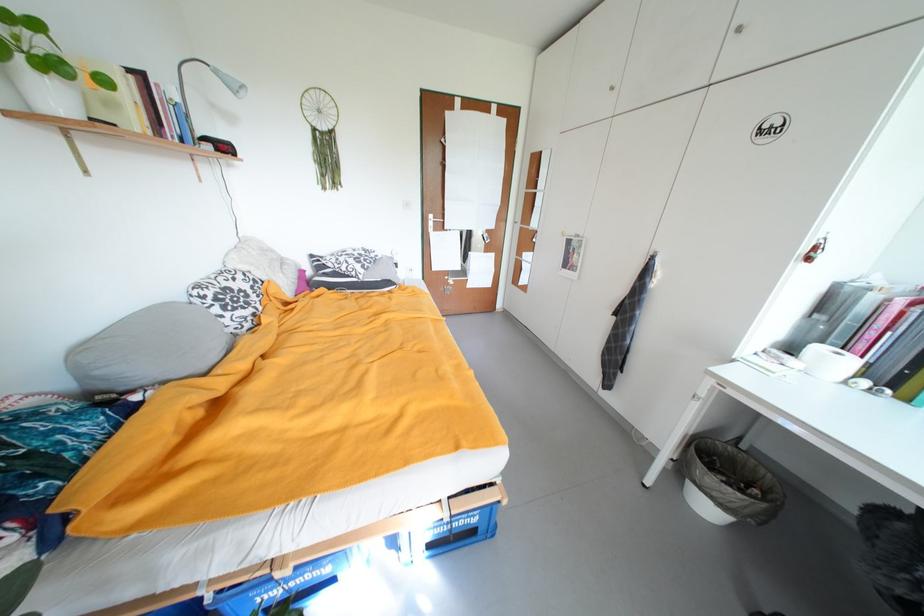
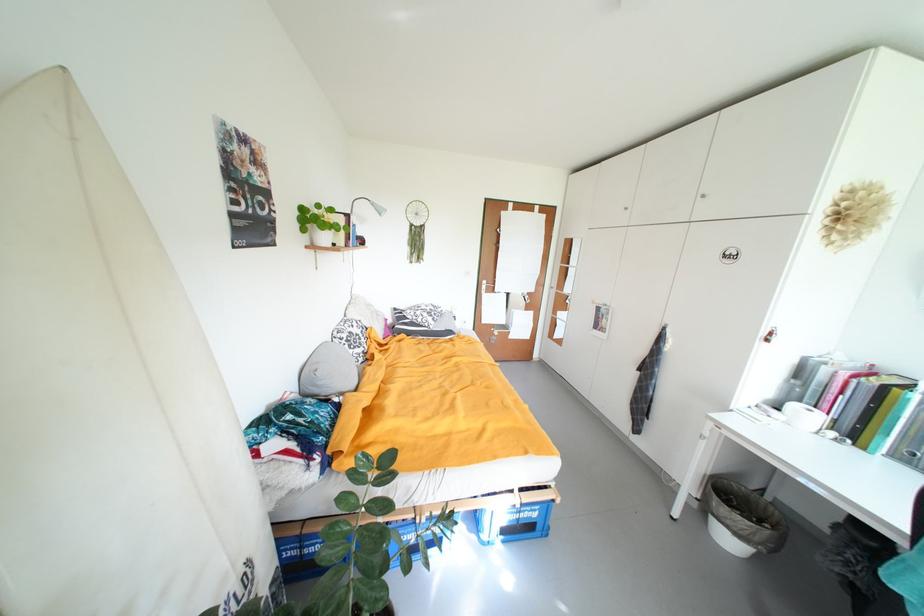
Find the pixel in the second image that matches [482,522] in the first image.

(543, 517)